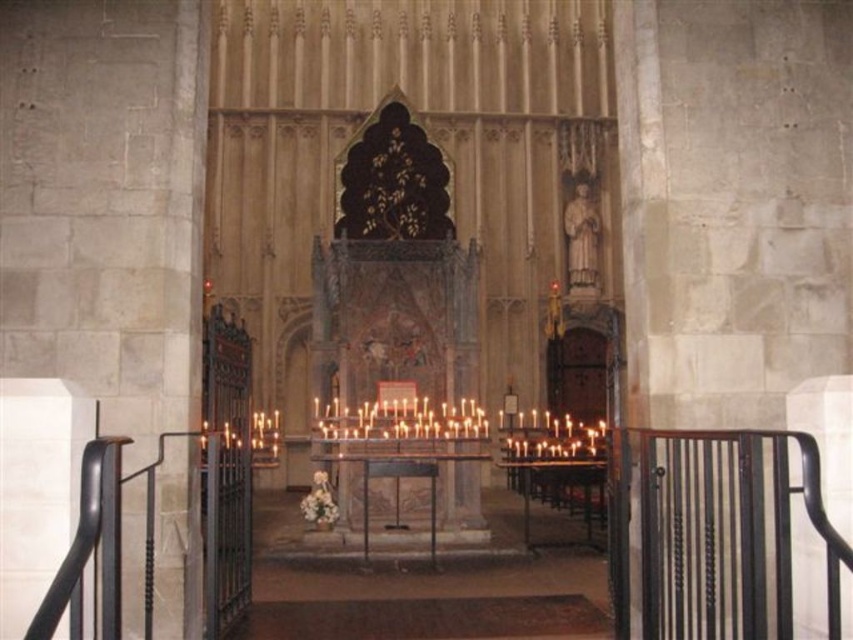
What do you see at coordinates (712, 532) in the screenshot? I see `black metal railing at lower right` at bounding box center [712, 532].

In the scene shown: Is black metal railing at lower right to the right of black metal railing at left from the viewer's perspective?

Indeed, black metal railing at lower right is positioned on the right side of black metal railing at left.

Describe the element at coordinates (712, 532) in the screenshot. I see `black metal railing at lower right` at that location.

You are a GUI agent. You are given a task and a screenshot of the screen. Output one action in this format:
    pyautogui.click(x=<x>, y=<y>)
    Task: Click on the black metal railing at lower right
    The width and height of the screenshot is (853, 640).
    Given the screenshot: What is the action you would take?
    pyautogui.click(x=712, y=532)